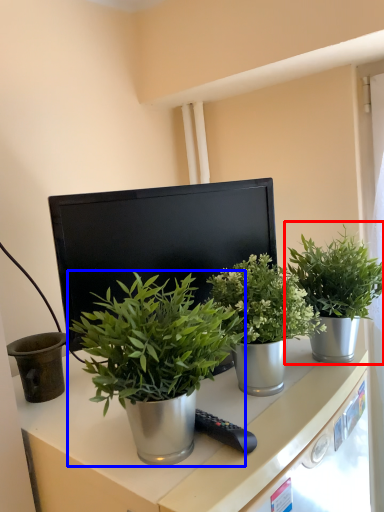
Question: Which object is further to the camera taking this photo, houseplant (highlighted by a red box) or houseplant (highlighted by a blue box)?

Choices:
 (A) houseplant
 (B) houseplant

Answer: (A)